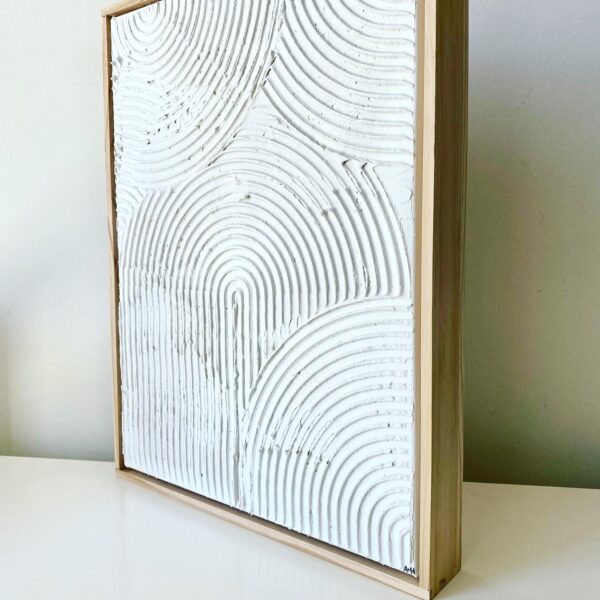
Identify the location of shelf. The image size is (600, 600). (211, 570), (519, 541).